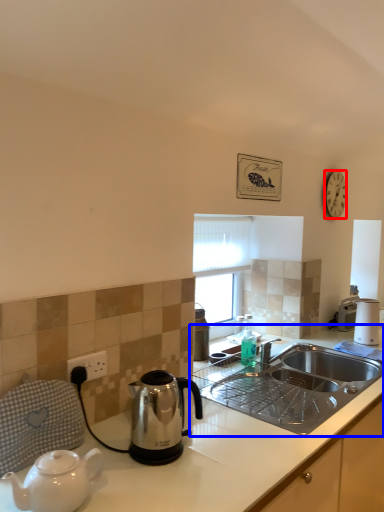
Question: Which object is further to the camera taking this photo, clock (highlighted by a red box) or countertop (highlighted by a blue box)?

Choices:
 (A) clock
 (B) countertop

Answer: (A)